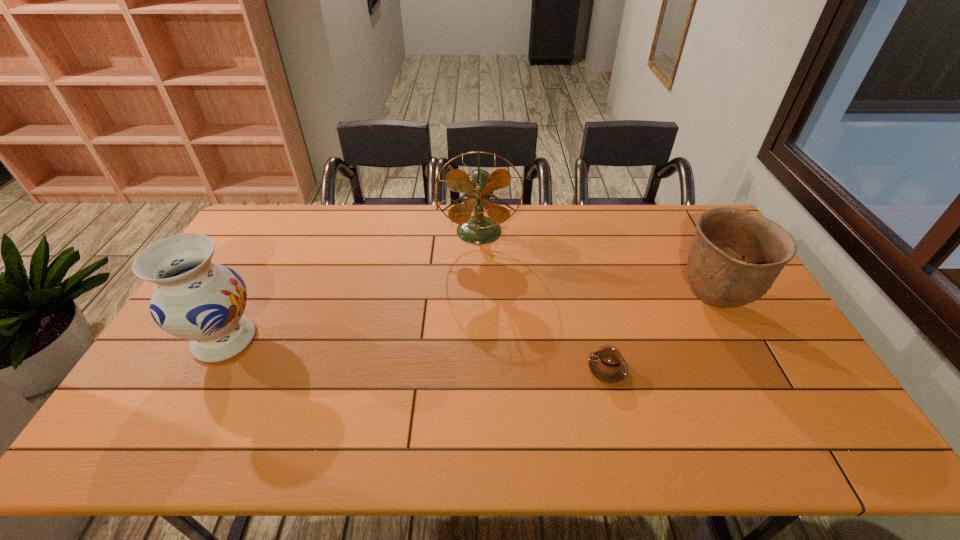
This screenshot has width=960, height=540. Find the location of `the third object from right to left`. the third object from right to left is located at coordinates (478, 185).

This screenshot has width=960, height=540. Find the location of `the farthest object`. the farthest object is located at coordinates (478, 185).

At what (x,y) coordinates should I click in order to perform the action: click on vase. Please return your answer as a coordinate pair (x, y). Image resolution: width=960 pixels, height=540 pixels. Looking at the image, I should click on 195,299.

Identify the location of pottery. (735, 256).

The height and width of the screenshot is (540, 960). I want to click on the third tallest object, so click(x=735, y=256).

Find the location of a particular element. cappuccino is located at coordinates (607, 365).

What are the coordinates of `the shortest object` in the screenshot? It's located at (607, 365).

Where is `free point located in front of the farthest object, directing air flow`? The width and height of the screenshot is (960, 540). free point located in front of the farthest object, directing air flow is located at coordinates (479, 316).

The width and height of the screenshot is (960, 540). Find the location of `blank space located on the back of the leftmost object`. blank space located on the back of the leftmost object is located at coordinates [x=261, y=271].

Find the location of a particular element. The width and height of the screenshot is (960, 540). vacant space located 0.390m on the back of the third tallest object is located at coordinates (662, 207).